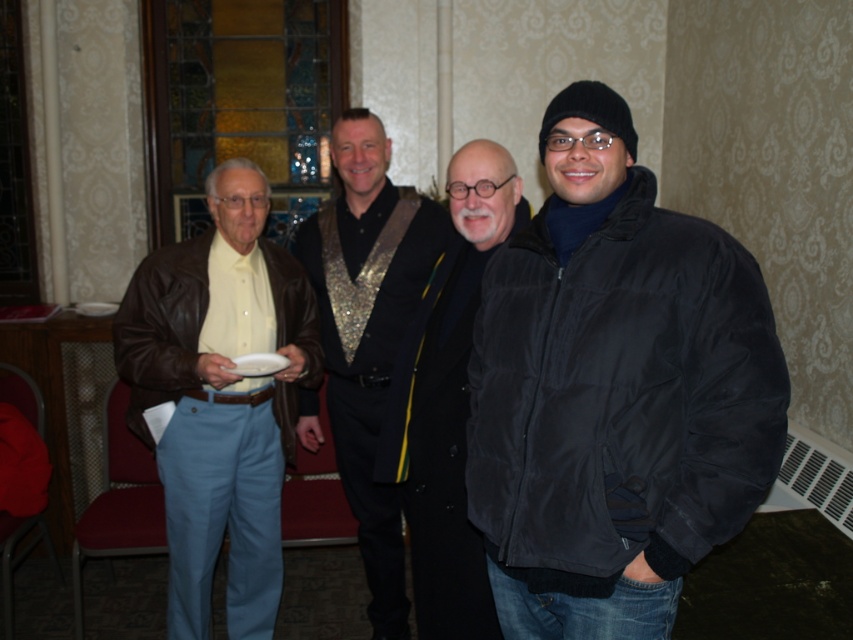
Question: Among these objects, which one is nearest to the camera?

Choices:
 (A) black matte jacket at center
 (B) white matte plate at center
 (C) black puffy jacket at right
 (D) matte brown leather jacket at left

Answer: (C)

Question: Estimate the real-world distances between objects in this image. Which object is closer to the white matte plate at center?

Choices:
 (A) black puffy jacket at right
 (B) shiny sequined vest at center

Answer: (B)

Question: Does black puffy jacket at right lie in front of white matte plate at center?

Choices:
 (A) yes
 (B) no

Answer: (A)

Question: From the image, what is the correct spatial relationship of matte brown leather jacket at left in relation to white matte plate at center?

Choices:
 (A) above
 (B) below

Answer: (B)

Question: Observing the image, what is the correct spatial positioning of shiny sequined vest at center in reference to white matte plate at center?

Choices:
 (A) below
 (B) above

Answer: (A)

Question: Which object appears closest to the camera in this image?

Choices:
 (A) black matte jacket at center
 (B) white matte plate at center
 (C) shiny sequined vest at center
 (D) black puffy jacket at right

Answer: (D)